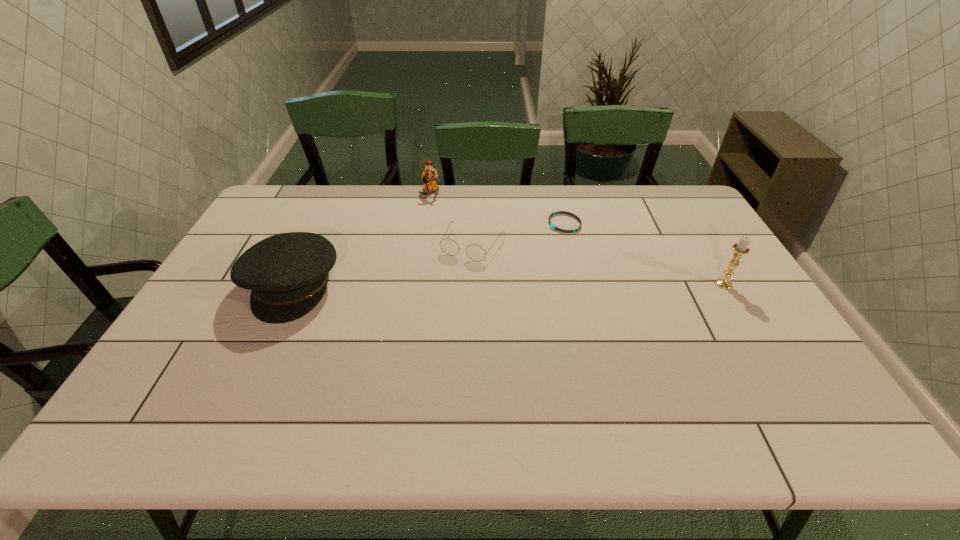
Locate an element on the screen. This screenshot has height=540, width=960. free space on the desktop that is between the leftmost object and the rightmost object and is positioned on the buckle of the second object from right to left is located at coordinates (447, 286).

Identify the location of free space on the desktop that is between the beret and the rightmost object and is positioned on the temples of the spectacles. The width and height of the screenshot is (960, 540). (448, 286).

You are a GUI agent. You are given a task and a screenshot of the screen. Output one action in this format:
    pyautogui.click(x=<x>, y=<y>)
    Task: Click on the vacant space on the desktop that is between the beret and the candle holder and is positioned holding a crossbow in the hands of the second object from left to right
    This screenshot has width=960, height=540.
    Given the screenshot: What is the action you would take?
    pyautogui.click(x=503, y=285)